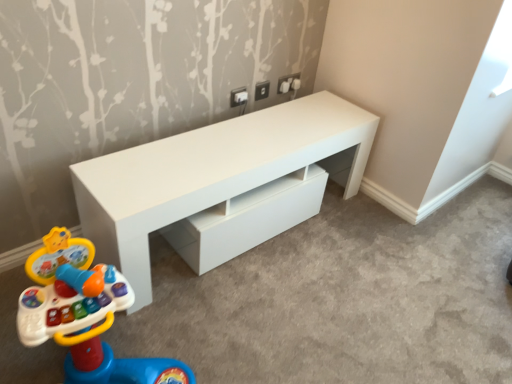
Question: From the image's perspective, is plastic multicolored xylophone at lower left below white glossy table at center?

Choices:
 (A) no
 (B) yes

Answer: (B)

Question: From a real-world perspective, is plastic multicolored xylophone at lower left located higher than white glossy table at center?

Choices:
 (A) yes
 (B) no

Answer: (A)

Question: Would you say plastic multicolored xylophone at lower left contains white glossy table at center?

Choices:
 (A) yes
 (B) no

Answer: (B)

Question: Is plastic multicolored xylophone at lower left further to the viewer compared to white glossy table at center?

Choices:
 (A) no
 (B) yes

Answer: (A)

Question: Does plastic multicolored xylophone at lower left have a smaller size compared to white glossy table at center?

Choices:
 (A) yes
 (B) no

Answer: (A)

Question: Is plastic multicolored xylophone at lower left bigger than white glossy table at center?

Choices:
 (A) no
 (B) yes

Answer: (A)

Question: Can you confirm if white glossy table at center is thinner than plastic multicolored xylophone at lower left?

Choices:
 (A) no
 (B) yes

Answer: (B)

Question: Is the depth of white glossy table at center less than that of plastic multicolored xylophone at lower left?

Choices:
 (A) yes
 (B) no

Answer: (B)

Question: Could you tell me if white glossy table at center is facing plastic multicolored xylophone at lower left?

Choices:
 (A) no
 (B) yes

Answer: (A)

Question: From a real-world perspective, is white glossy table at center positioned over plastic multicolored xylophone at lower left based on gravity?

Choices:
 (A) yes
 (B) no

Answer: (B)

Question: Can you confirm if white glossy table at center is shorter than plastic multicolored xylophone at lower left?

Choices:
 (A) yes
 (B) no

Answer: (A)

Question: Could plastic multicolored xylophone at lower left be considered to be inside white glossy table at center?

Choices:
 (A) no
 (B) yes

Answer: (A)

Question: In terms of height, does white glossy table at center look taller or shorter compared to plastic multicolored xylophone at lower left?

Choices:
 (A) tall
 (B) short

Answer: (B)